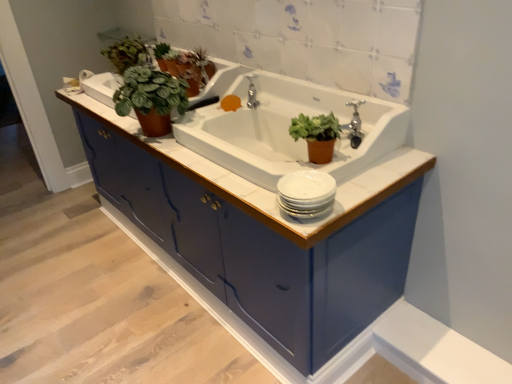
You are a GUI agent. You are given a task and a screenshot of the screen. Output one action in this format:
    pyautogui.click(x=<x>, y=<y>)
    Task: Click on the vacant region to the left of matte brown pot at center, the first houseplant in the front-to-back sequence
    Image resolution: width=512 pixels, height=384 pixels.
    Given the screenshot: What is the action you would take?
    pyautogui.click(x=246, y=181)